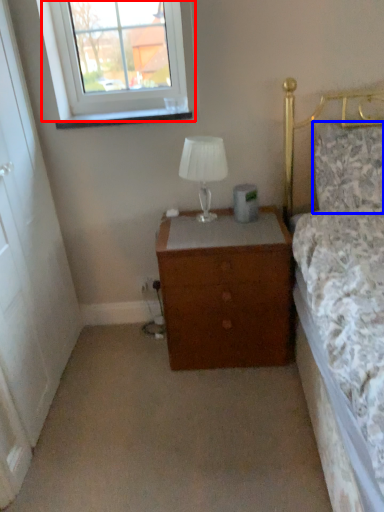
Question: Which of the following is the farthest to the observer, window (highlighted by a red box) or pillow (highlighted by a blue box)?

Choices:
 (A) window
 (B) pillow

Answer: (A)